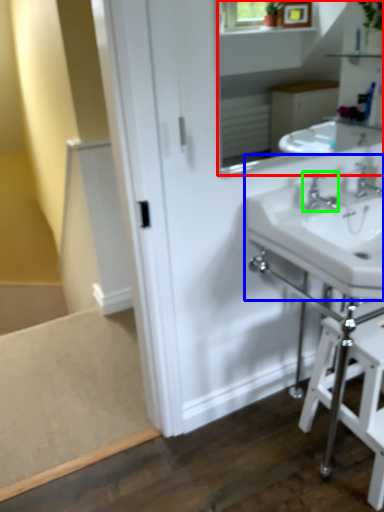
Question: Which object is the closest to the mirror (highlighted by a red box)? Choose among these: sink (highlighted by a blue box) or tap (highlighted by a green box).

Choices:
 (A) sink
 (B) tap

Answer: (A)